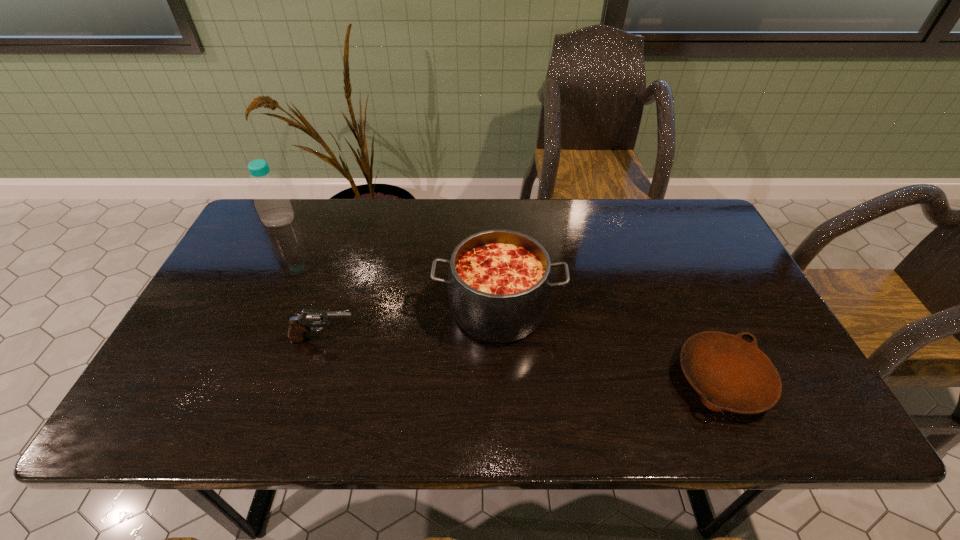
At what (x,y) coordinates should I click in order to perform the action: click on free space at the right edge of the desktop. Please return your answer as a coordinate pair (x, y). This screenshot has width=960, height=540. Looking at the image, I should click on click(x=711, y=286).

I want to click on vacant space at the near left corner, so click(x=165, y=422).

Where is `vacant space at the far right corner`? The width and height of the screenshot is (960, 540). vacant space at the far right corner is located at coordinates (707, 224).

What are the coordinates of `free spot between the second object from right to left and the shortest object` in the screenshot? It's located at (611, 345).

What are the coordinates of `free spot between the second shortest object and the third object from left to right` in the screenshot? It's located at (412, 325).

I want to click on vacant point located between the plate and the pistol, so click(x=523, y=359).

You are a GUI agent. You are given a task and a screenshot of the screen. Output one action in this format:
    pyautogui.click(x=<x>, y=<y>)
    Task: Click on the free space between the leftmost object and the second object from left to right
    This screenshot has width=960, height=540.
    Given the screenshot: What is the action you would take?
    pyautogui.click(x=302, y=280)

Locate an element on the screen. The image size is (960, 540). blank region between the plate and the third object from right to left is located at coordinates pyautogui.click(x=523, y=359).

Locate an element on the screen. This screenshot has width=960, height=540. vacant space in between the shortest object and the second object from right to left is located at coordinates (611, 345).

You are a GUI agent. You are given a task and a screenshot of the screen. Output one action in this format:
    pyautogui.click(x=<x>, y=<y>)
    Task: Click on the free space that is in between the second shortest object and the casserole
    This screenshot has height=540, width=960.
    Given the screenshot: What is the action you would take?
    pos(412,325)